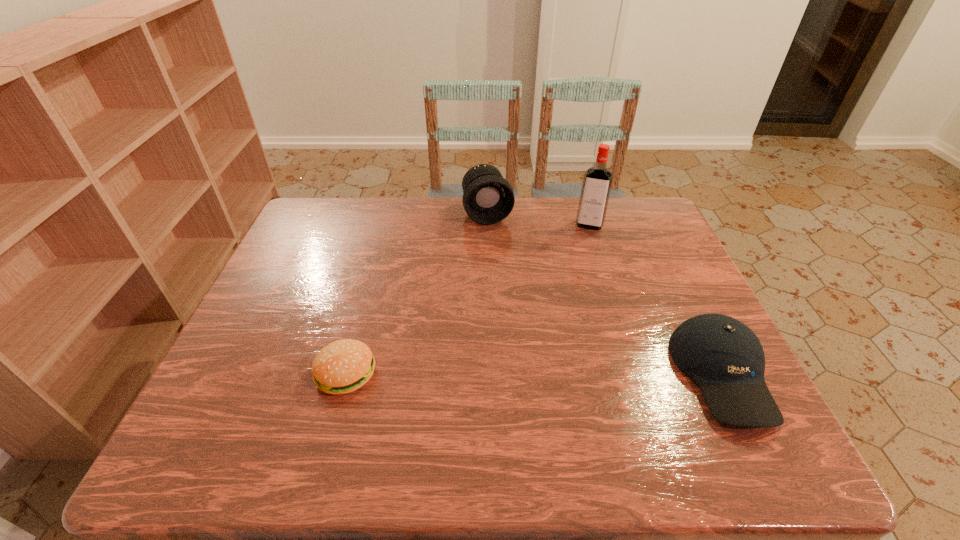
Image resolution: width=960 pixels, height=540 pixels. In order to click on object that is at the near right corner in this screenshot , I will do `click(724, 357)`.

In the image, there is a desktop. Where is `vacant space at the far edge`? This screenshot has width=960, height=540. vacant space at the far edge is located at coordinates (374, 214).

The height and width of the screenshot is (540, 960). I want to click on vacant space at the near edge of the desktop, so click(x=641, y=388).

Find the location of a particular element. This screenshot has height=540, width=960. vacant space at the left edge of the desktop is located at coordinates (278, 340).

In the image, there is a desktop. At what (x,y) coordinates should I click in order to perform the action: click on vacant space at the right edge. Please return your answer as a coordinate pair (x, y). Looking at the image, I should click on (689, 310).

Find the location of a particular element. blank space at the near left corner of the desktop is located at coordinates tap(233, 413).

This screenshot has height=540, width=960. What are the coordinates of `free location at the far right corner` in the screenshot? It's located at (618, 225).

Find the location of a particular element. This screenshot has height=540, width=960. vacant area between the telephoto lens and the third object from left to right is located at coordinates (539, 219).

Find the location of a particular element. The image size is (960, 540). vacant area that lies between the vodka and the second tallest object is located at coordinates (539, 219).

Image resolution: width=960 pixels, height=540 pixels. Identify the location of vacant space that is in between the baseball cap and the third object from right to left. (605, 294).